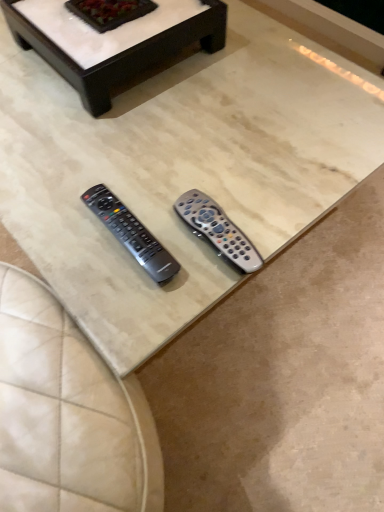
Question: Does point (225, 253) appear closer or farther from the camera than point (360, 87)?

Choices:
 (A) farther
 (B) closer

Answer: (B)

Question: From the image's perspective, relative to beige marble coffee table at center, the first coffee table in the front-to-back sequence, is translucent gray remote at center, arranged as the 1th remote control when viewed from the right, above or below?

Choices:
 (A) above
 (B) below

Answer: (B)

Question: Which object is positioned farthest from the beige marble coffee table at center, the first coffee table in the front-to-back sequence?

Choices:
 (A) white marble coffee table at upper center, which appears as the second coffee table when viewed from the front
 (B) silver metallic remote at center, which is counted as the first remote control, starting from the left
 (C) translucent gray remote at center, positioned as the 2th remote control in left-to-right order

Answer: (B)

Question: Which object is positioned closest to the white marble coffee table at upper center, which appears as the second coffee table when viewed from the front?

Choices:
 (A) beige marble coffee table at center, acting as the 2th coffee table starting from the back
 (B) translucent gray remote at center, positioned as the 2th remote control in left-to-right order
 (C) silver metallic remote at center, which ranks as the second remote control in right-to-left order

Answer: (A)